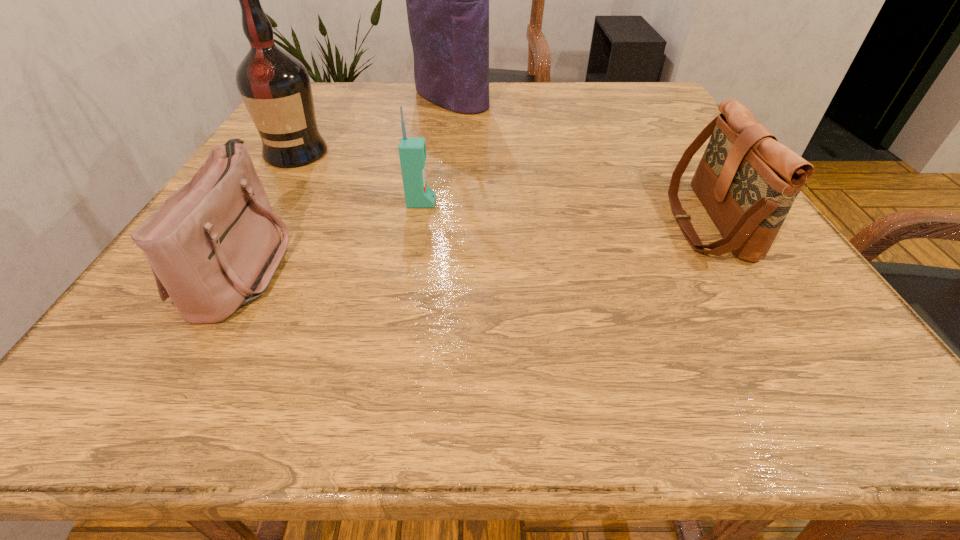
Find the location of a particular element. The height and width of the screenshot is (540, 960). vacant area that lies between the right shoulder bag and the left shoulder bag is located at coordinates (475, 244).

Find the location of `blank region between the cellular telephone and the rightmost object`. blank region between the cellular telephone and the rightmost object is located at coordinates (564, 212).

Locate an element on the screen. object that is the closest to the farthest object is located at coordinates (275, 86).

Locate which object ranks third in proximity to the left shoulder bag. Please provide its 2D coordinates. Your answer should be formatted as a tuple, i.e. [(x, y)], where the tuple contains the x and y coordinates of a point satisfying the conditions above.

[(447, 0)]